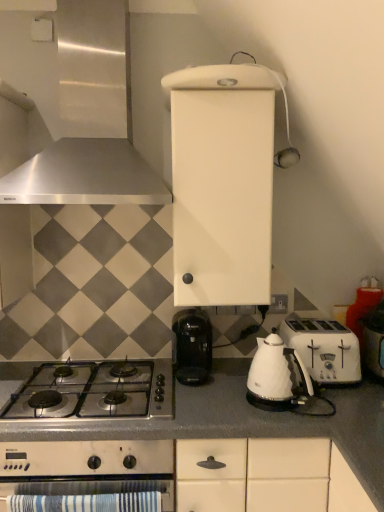
The height and width of the screenshot is (512, 384). What do you see at coordinates (97, 391) in the screenshot?
I see `stainless steel gas stove at lower left` at bounding box center [97, 391].

Image resolution: width=384 pixels, height=512 pixels. Describe the element at coordinates (324, 349) in the screenshot. I see `white plastic toaster at right` at that location.

The image size is (384, 512). What do you see at coordinates (278, 304) in the screenshot? I see `white plastic electric outlet at center-right` at bounding box center [278, 304].

At what (x,y) coordinates should I click in order to perform the action: click on white plastic toaster at right. Please return your answer as a coordinate pair (x, y). Looking at the image, I should click on (374, 340).

Find the location of a particular element. The height and width of the screenshot is (512, 384). white glossy kettle at lower center is located at coordinates (277, 372).

In order to face gray matte countertop at lower center, should I rotate leftwards or rightwards?

You should look right and rotate roughly 0.463 degrees.

What do you see at coordinates (248, 422) in the screenshot? I see `gray matte countertop at lower center` at bounding box center [248, 422].

I want to click on stainless steel gas stove at lower left, so click(x=97, y=391).

Does gray matte countertop at lower center have a lesser width compared to white glossy kettle at lower center?

No, gray matte countertop at lower center is not thinner than white glossy kettle at lower center.

Does gray matte countertop at lower center turn towards white glossy kettle at lower center?

No.

From the image's perspective, which is above, gray matte countertop at lower center or white glossy kettle at lower center?

white glossy kettle at lower center, from the image's perspective.

Does gray matte countertop at lower center have a lesser height compared to white glossy kettle at lower center?

In fact, gray matte countertop at lower center may be taller than white glossy kettle at lower center.

Is gray matte countertop at lower center positioned beyond the bounds of satin silver range hood at upper left?

Yes.

Is gray matte countertop at lower center thinner than satin silver range hood at upper left?

In fact, gray matte countertop at lower center might be wider than satin silver range hood at upper left.

Is gray matte countertop at lower center positioned far away from satin silver range hood at upper left?

No.

Does white plastic electric outlet at center-right have a smaller size compared to gray matte countertop at lower center?

Correct, white plastic electric outlet at center-right occupies less space than gray matte countertop at lower center.

Does white plastic electric outlet at center-right have a lesser width compared to gray matte countertop at lower center?

Yes.

Does point (270, 305) lie behind point (92, 431)?

Yes, point (270, 305) is behind point (92, 431).

Is there a large distance between white plastic electric outlet at center-right and gray matte countertop at lower center?

Actually, white plastic electric outlet at center-right and gray matte countertop at lower center are a little close together.

Considering the relative positions of stainless steel gas stove at lower left and satin silver range hood at upper left in the image provided, is stainless steel gas stove at lower left to the right of satin silver range hood at upper left from the viewer's perspective?

Yes.

Is stainless steel gas stove at lower left facing towards satin silver range hood at upper left?

No, stainless steel gas stove at lower left is not aimed at satin silver range hood at upper left.

Considering the relative sizes of stainless steel gas stove at lower left and satin silver range hood at upper left in the image provided, is stainless steel gas stove at lower left smaller than satin silver range hood at upper left?

Correct, stainless steel gas stove at lower left occupies less space than satin silver range hood at upper left.

Is stainless steel gas stove at lower left next to satin silver range hood at upper left?

No, stainless steel gas stove at lower left is not in contact with satin silver range hood at upper left.

Is point (274, 379) less distant than point (381, 319)?

Yes, it is in front of point (381, 319).

From a real-world perspective, which object stands above the other?

From a 3D spatial view, white plastic toaster at right is above.

Identify the location of tea pot below the white plastic toaster at right (from a real-world perspective). [277, 372].

Can you tell me how much white glossy kettle at lower center and white plastic toaster at right differ in facing direction?

They differ by 38.3 degrees in their facing directions.

Is satin silver range hood at upper left directly adjacent to gray matte countertop at lower center?

No, satin silver range hood at upper left is not making contact with gray matte countertop at lower center.

Is satin silver range hood at upper left wider than gray matte countertop at lower center?

In fact, satin silver range hood at upper left might be narrower than gray matte countertop at lower center.

Is satin silver range hood at upper left at the left side of gray matte countertop at lower center?

Yes, satin silver range hood at upper left is to the left of gray matte countertop at lower center.

Is satin silver range hood at upper left facing away from gray matte countertop at lower center?

No, satin silver range hood at upper left is not facing the opposite direction of gray matte countertop at lower center.

Is white plastic toaster at right wider than white glossy kettle at lower center?

Correct, the width of white plastic toaster at right exceeds that of white glossy kettle at lower center.

Considering the sizes of white plastic toaster at right and white glossy kettle at lower center in the image, is white plastic toaster at right taller or shorter than white glossy kettle at lower center?

white plastic toaster at right is shorter than white glossy kettle at lower center.

Which is more to the left, white plastic toaster at right or white glossy kettle at lower center?

From the viewer's perspective, white glossy kettle at lower center appears more on the left side.

Which point is more forward, (318, 350) or (294, 351)?

The point (294, 351) is closer.

This screenshot has width=384, height=512. I want to click on tea pot that appears on the right of gray matte countertop at lower center, so click(x=277, y=372).

Find the location of a particular element. kitchen appliance located in front of the gray matte countertop at lower center is located at coordinates (70, 108).

From the image, which object appears to be nearer to stainless steel gas stove at lower left, white plastic electric outlet at center-right or satin silver range hood at upper left?

white plastic electric outlet at center-right lies closer to stainless steel gas stove at lower left than the other object.

Estimate the real-world distances between objects in this image. Which object is further from white glossy kettle at lower center, white plastic toaster at right or satin silver range hood at upper left?

Among the two, satin silver range hood at upper left is located further to white glossy kettle at lower center.

Estimate the real-world distances between objects in this image. Which object is further from white glossy kettle at lower center, satin silver range hood at upper left or white plastic toaster at right?

satin silver range hood at upper left is further to white glossy kettle at lower center.

Looking at the image, which one is located closer to white plastic toaster at right, gray matte countertop at lower center or white plastic electric outlet at center-right?

Among the two, gray matte countertop at lower center is located nearer to white plastic toaster at right.

When comparing their distances from stainless steel gas stove at lower left, does white plastic toaster at right or white plastic electric outlet at center-right seem closer?

Based on the image, white plastic electric outlet at center-right appears to be nearer to stainless steel gas stove at lower left.

Considering their positions, is white plastic toaster at right positioned closer to white glossy kettle at lower center than gray matte countertop at lower center?

The object closer to white glossy kettle at lower center is gray matte countertop at lower center.

Estimate the real-world distances between objects in this image. Which object is closer to white plastic toaster at right, white glossy kettle at lower center or satin silver range hood at upper left?

white glossy kettle at lower center.

Which object lies further to the anchor point satin silver range hood at upper left, gray matte countertop at lower center or white plastic electric outlet at center-right?

white plastic electric outlet at center-right is further to satin silver range hood at upper left.

Locate an element on the screen. This screenshot has height=512, width=384. electric outlet between satin silver range hood at upper left and white plastic toaster at right is located at coordinates pos(278,304).

Identify the location of toaster between stainless steel gas stove at lower left and white plastic toaster at right from left to right. (324, 349).

I want to click on gas stove between satin silver range hood at upper left and white plastic toaster at right from left to right, so click(97, 391).

Identify the location of tea pot between white plastic electric outlet at center-right and gray matte countertop at lower center in the vertical direction. (277, 372).